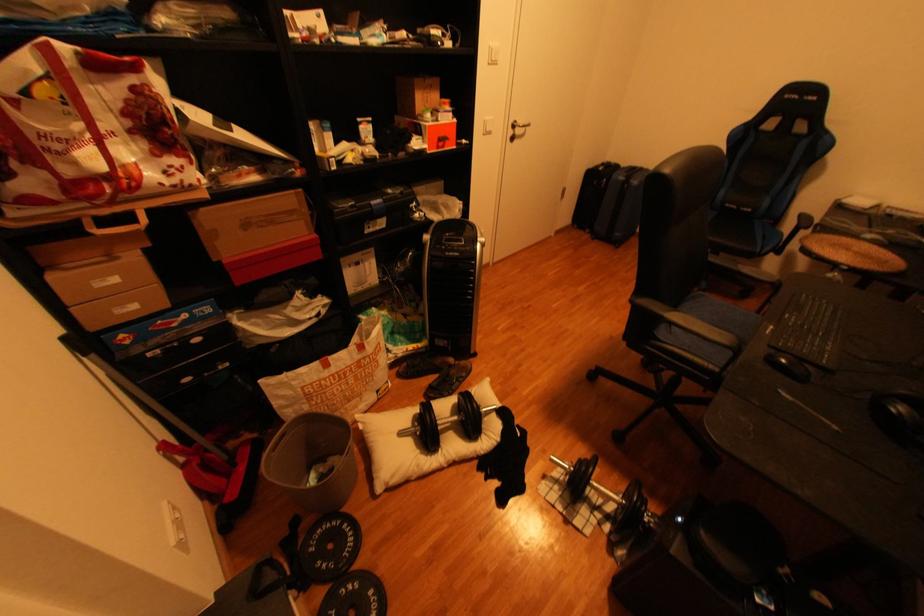
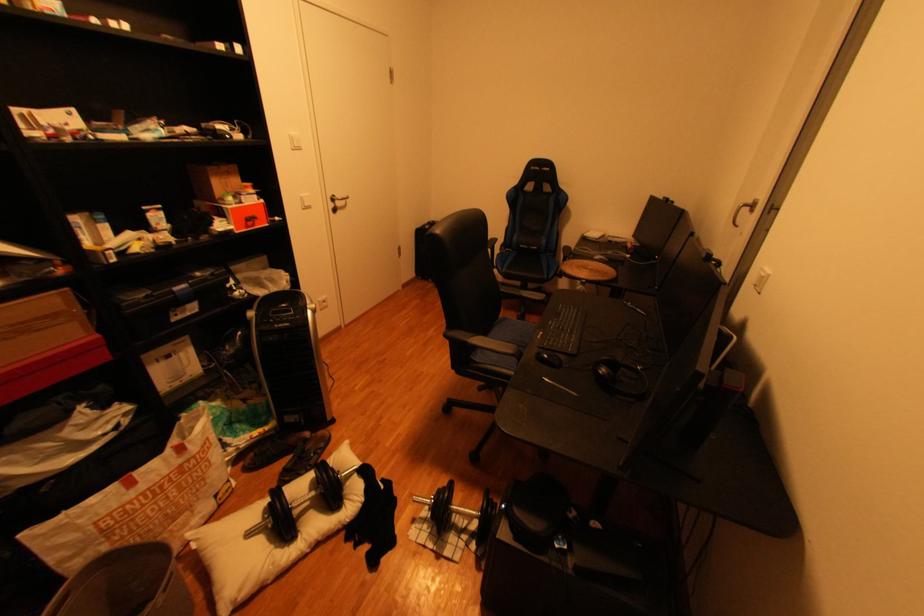
The point at (459, 392) is marked in the first image. Where is the corresponding point in the second image?

(318, 468)